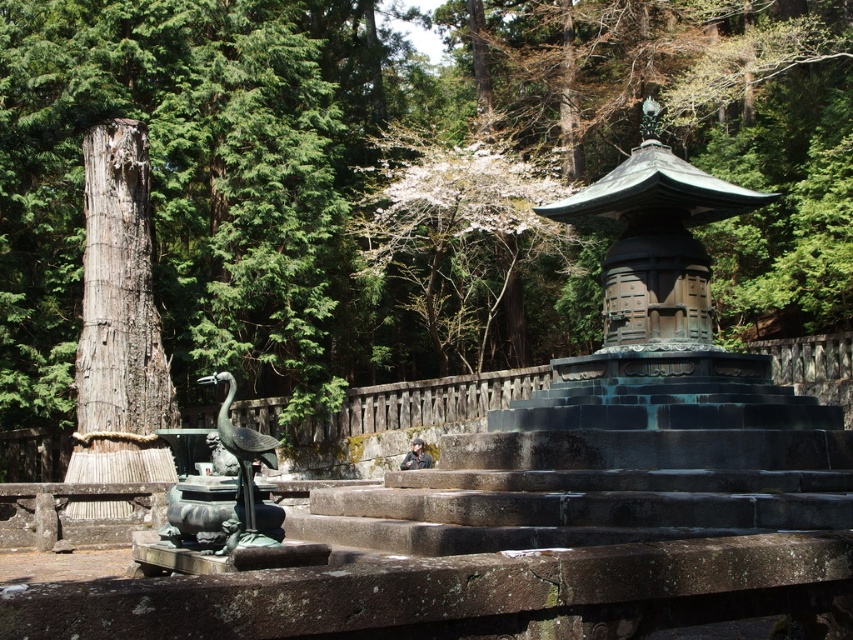
Question: Considering the relative positions of smooth bark tree at left and weathered wood pillar at left in the image provided, where is smooth bark tree at left located with respect to weathered wood pillar at left?

Choices:
 (A) above
 (B) below

Answer: (A)

Question: Which point is farther from the camera taking this photo?

Choices:
 (A) (225, 403)
 (B) (476, 224)
 (C) (216, 323)

Answer: (B)

Question: Based on their relative distances, which object is nearer to the bronze statue at center?

Choices:
 (A) white blossoms at upper center
 (B) weathered wood pillar at left
 (C) smooth bark tree at left

Answer: (B)

Question: Can you confirm if white blossoms at upper center is wider than weathered wood pillar at left?

Choices:
 (A) no
 (B) yes

Answer: (B)

Question: Which object is closer to the camera taking this photo?

Choices:
 (A) weathered wood pillar at left
 (B) bronze statue at center
 (C) smooth bark tree at left

Answer: (B)

Question: Can you confirm if weathered wood pillar at left is smaller than bronze statue at center?

Choices:
 (A) no
 (B) yes

Answer: (B)